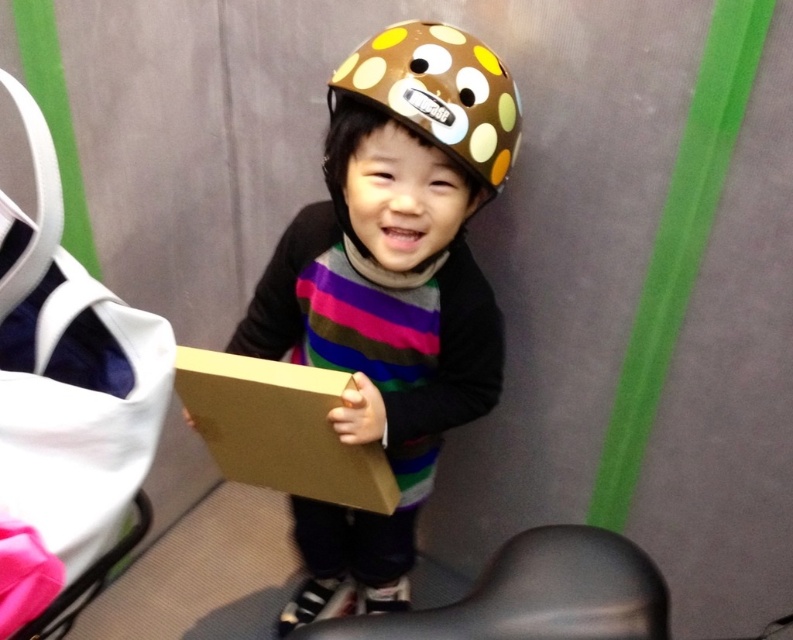
You are a delivery person who needs to place a brown cardboard box at center on a shelf. The shelf has a height limit of 12 inches. Can you determine if the brown dotted helmet at center will fit on the same shelf without exceeding the height limit?

The brown dotted helmet at center is 13.48 inches away from brown cardboard box at center. Since the shelf has a height limit of 12 inches, the brown dotted helmet at center is taller than the allowed height and cannot be placed on the shelf.

You are a photographer trying to capture the child wearing the brown matte helmet at center and the brown dotted helmet at center. Since both helmets are brown, you need to adjust your camera angle to ensure both are visible. Based on their positions, which helmet should you focus on first to ensure both are in frame?

The brown dotted helmet at center is behind the brown matte helmet at center, so you should focus on the brown matte helmet at center first to ensure both are visible in the frame.

You are a photographer adjusting the focus on your camera. The subject is the brown matte helmet at center. The camera can focus on objects within 30 inches. Is the helmet within the focus range?

The brown matte helmet at center is 33.06 inches from the camera, which is beyond the 30 inch focus range. The camera cannot focus on it.